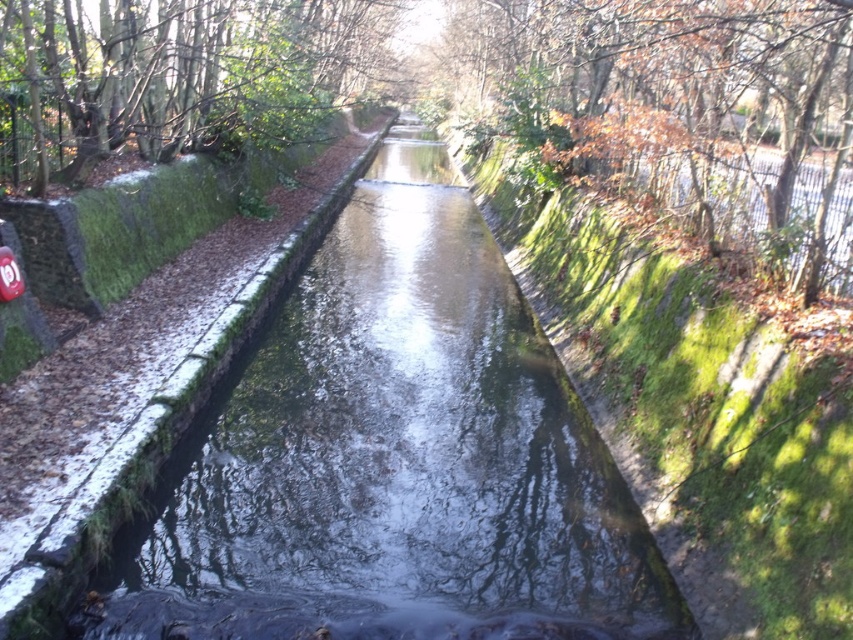
You are a photographer standing at the edge of the green mossy stream at center and want to capture a photo of the brown leafy tree at upper right. Since the tree is partially hidden by the fence on the right, will you need to move closer or farther away to get a clearer view of the tree?

The green mossy stream at center is closer to the viewer than the brown leafy tree at upper right, so to get a clearer view of the brown leafy tree at upper right, you should move closer to reduce the obstruction from the fence.

In the scene shown: You are a hiker trying to cross the green mossy stream at center. There is a fallen tree trunk that is 1.2 meters tall. Can you use the green mossy tree at upper left as a support to step over the stream?

The green mossy stream at center is shorter than the green mossy tree at upper left, so the tree is taller. However, the height of the tree does not directly indicate if it can be used as a support for stepping over the stream. The fallen tree trunk is 1.2 meters tall, but without knowing the distance between the tree and the stream or the stability of the mossy tree, it is uncertain if it can be safely used as support.

You are a small boat navigating the canal and need to pass through the narrowest part. Based on the scene, which object between the green mossy stream at center and the green mossy tree at upper left should you avoid?

The green mossy tree at upper left is narrower than the green mossy stream at center, so you should avoid the green mossy tree at upper left to navigate safely.